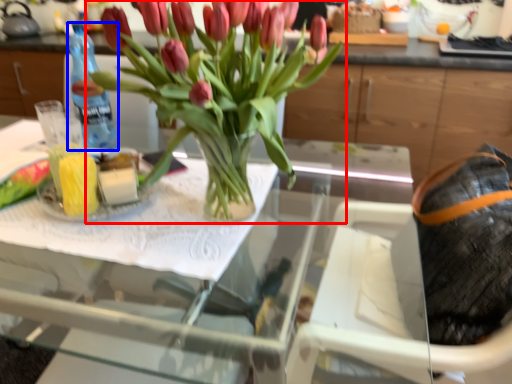
Question: Which of the following is the closest to the observer, houseplant (highlighted by a red box) or bottle (highlighted by a blue box)?

Choices:
 (A) houseplant
 (B) bottle

Answer: (A)